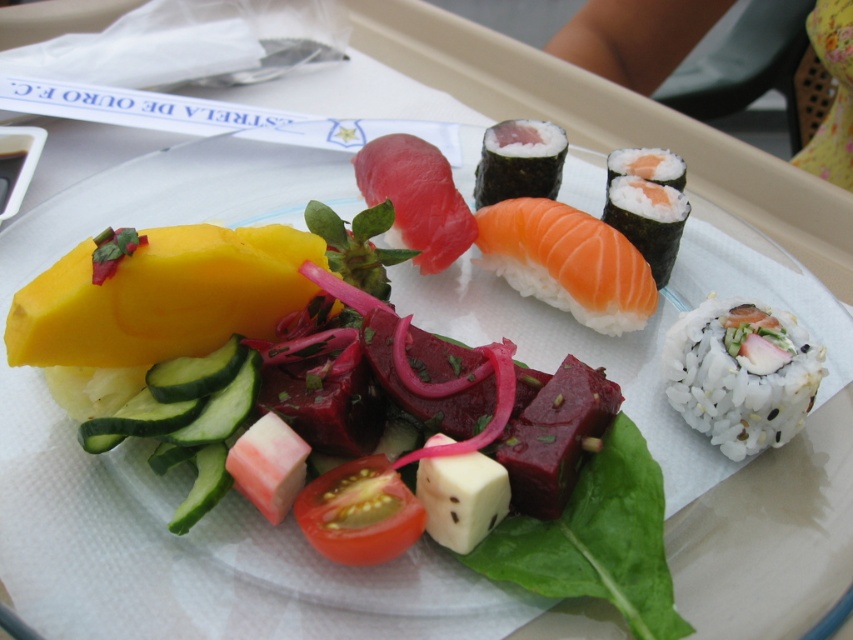
Does slightly translucent red tomato at center have a greater width compared to white rice at upper center?

Yes.

Does slightly translucent red tomato at center have a lesser height compared to white rice at upper center?

No.

This screenshot has width=853, height=640. What are the coordinates of `slightly translucent red tomato at center` in the screenshot? It's located at (358, 513).

Locate an element on the screen. slightly translucent red tomato at center is located at coordinates (358, 513).

Is white rice roll at right smaller than slightly translucent red tomato at center?

Incorrect, white rice roll at right is not smaller in size than slightly translucent red tomato at center.

Is white rice roll at right taller than slightly translucent red tomato at center?

Correct, white rice roll at right is much taller as slightly translucent red tomato at center.

Between point (727, 316) and point (412, 508), which one is positioned in front?

Point (412, 508) is more forward.

At what (x,y) coordinates should I click in order to perform the action: click on white rice roll at right. Please return your answer as a coordinate pair (x, y). Looking at the image, I should click on (741, 372).

Can you confirm if yellow smooth mango at lower left is positioned to the right of white rice wrapped in seaweed at upper right?

No, yellow smooth mango at lower left is not to the right of white rice wrapped in seaweed at upper right.

Can you confirm if yellow smooth mango at lower left is wider than white rice wrapped in seaweed at upper right?

Correct, the width of yellow smooth mango at lower left exceeds that of white rice wrapped in seaweed at upper right.

Is point (287, 312) closer to viewer compared to point (547, 134)?

Yes, it is.

Where is `yellow smooth mango at lower left`? This screenshot has height=640, width=853. yellow smooth mango at lower left is located at coordinates (161, 296).